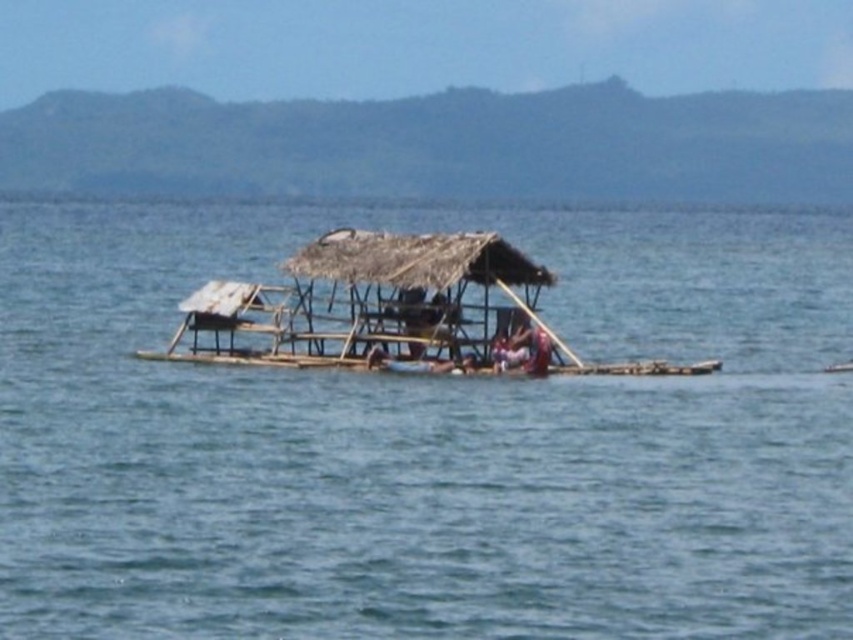
Question: Which point is farther to the camera?

Choices:
 (A) (531, 321)
 (B) (543, 365)
 (C) (355, 269)

Answer: (A)

Question: In this image, where is bamboo raft at center located relative to pink fabric at center?

Choices:
 (A) above
 (B) below

Answer: (B)

Question: Estimate the real-world distances between objects in this image. Which object is farther from the pink fabric at center?

Choices:
 (A) bamboo raft at center
 (B) bamboo paddle at center

Answer: (A)

Question: Is bamboo raft at center wider than bamboo paddle at center?

Choices:
 (A) no
 (B) yes

Answer: (A)

Question: Which is farther from the pink fabric at center?

Choices:
 (A) clear blue water at center
 (B) bamboo paddle at center

Answer: (A)

Question: Is clear blue water at center positioned at the back of pink fabric at center?

Choices:
 (A) no
 (B) yes

Answer: (A)